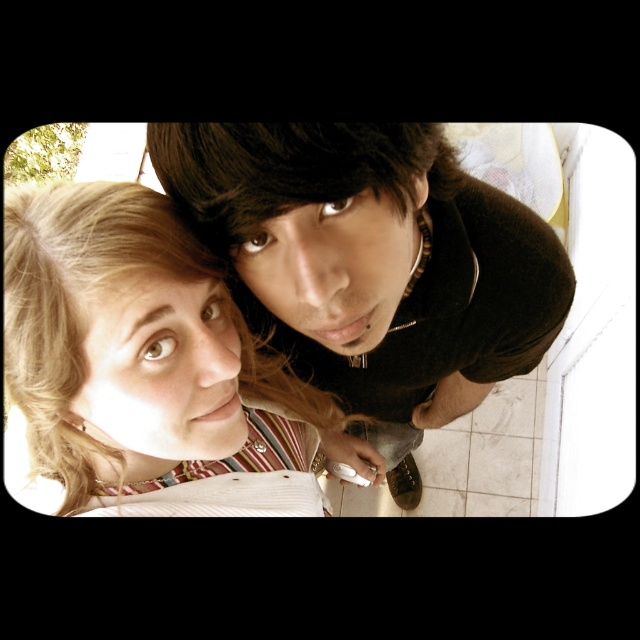
Does dark brown corduroy shirt at upper center have a greater height compared to blonde hair at upper left?

Yes, dark brown corduroy shirt at upper center is taller than blonde hair at upper left.

Does dark brown corduroy shirt at upper center appear on the left side of blonde hair at upper left?

Incorrect, dark brown corduroy shirt at upper center is not on the left side of blonde hair at upper left.

Locate an element on the screen. The height and width of the screenshot is (640, 640). dark brown corduroy shirt at upper center is located at coordinates (372, 266).